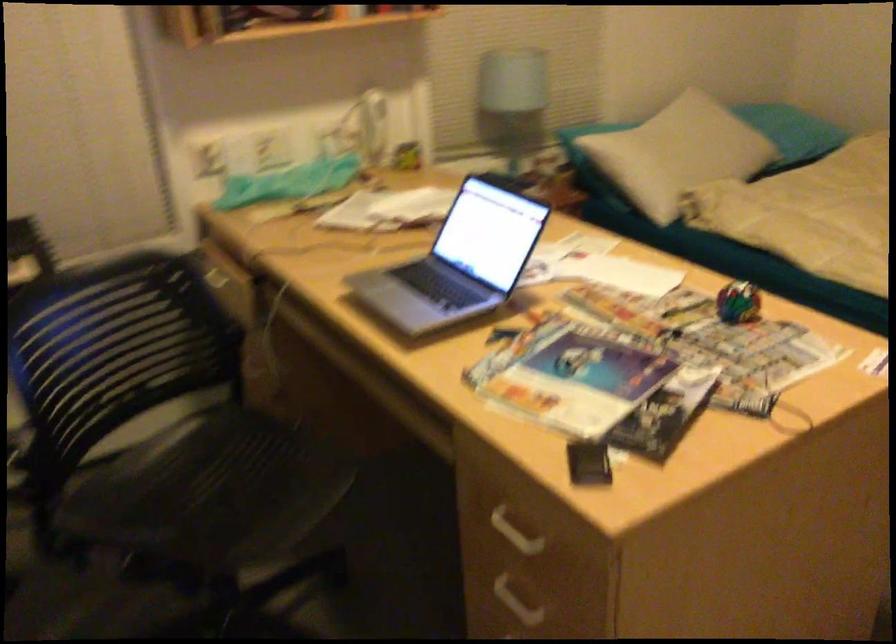
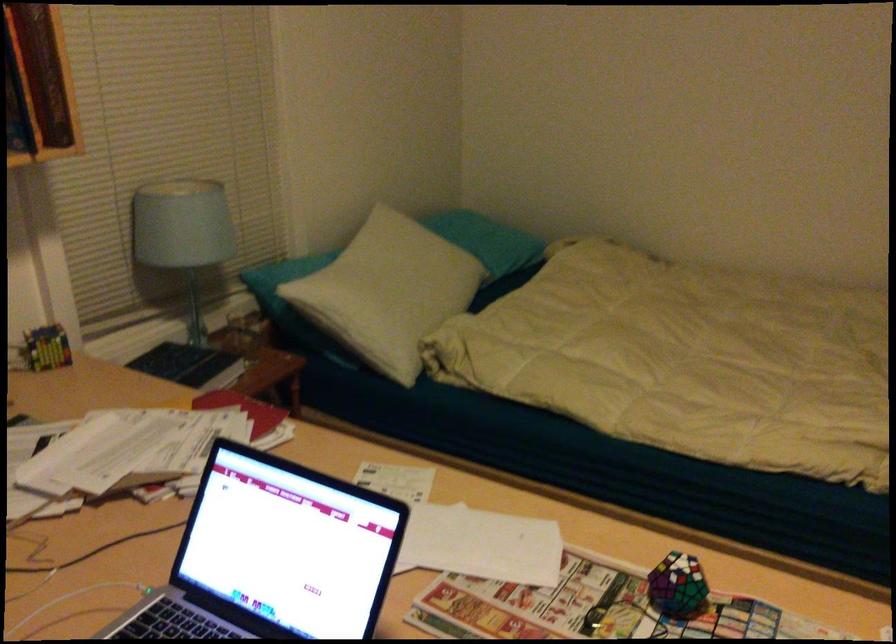
Where in the second image is the point corresponding to pixel 660 152 from the first image?

(389, 292)